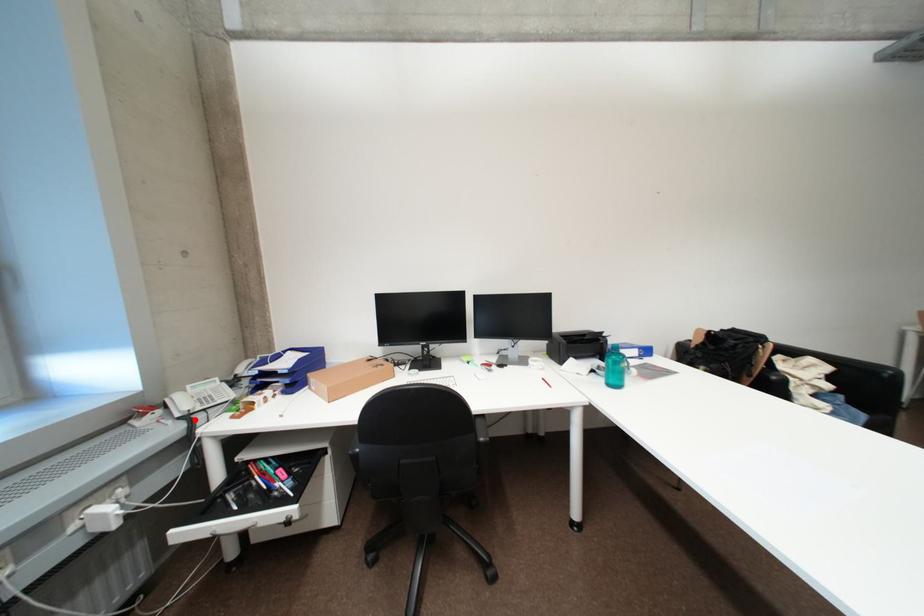
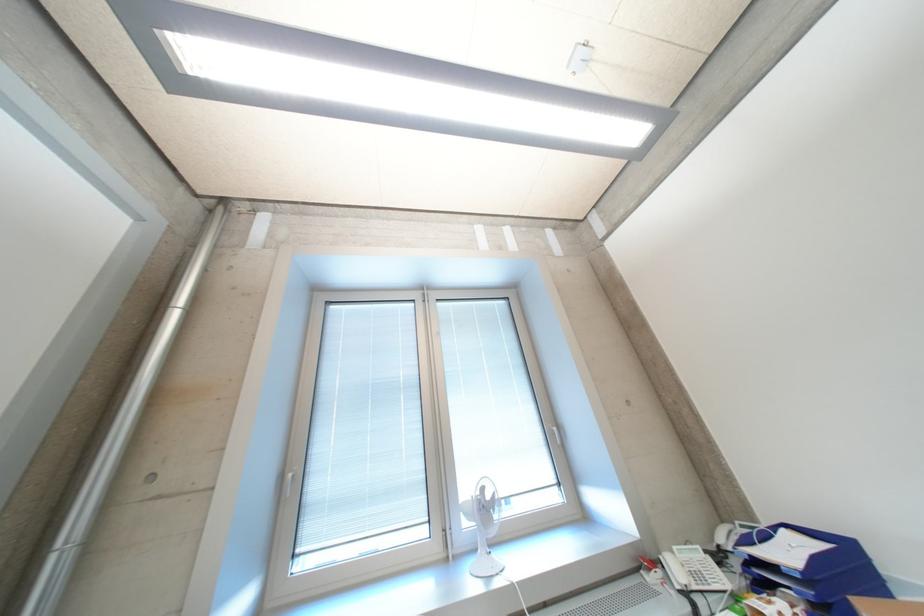
Locate, in the second image, the point that corresponds to the highlighted location in the first image.

(696, 597)